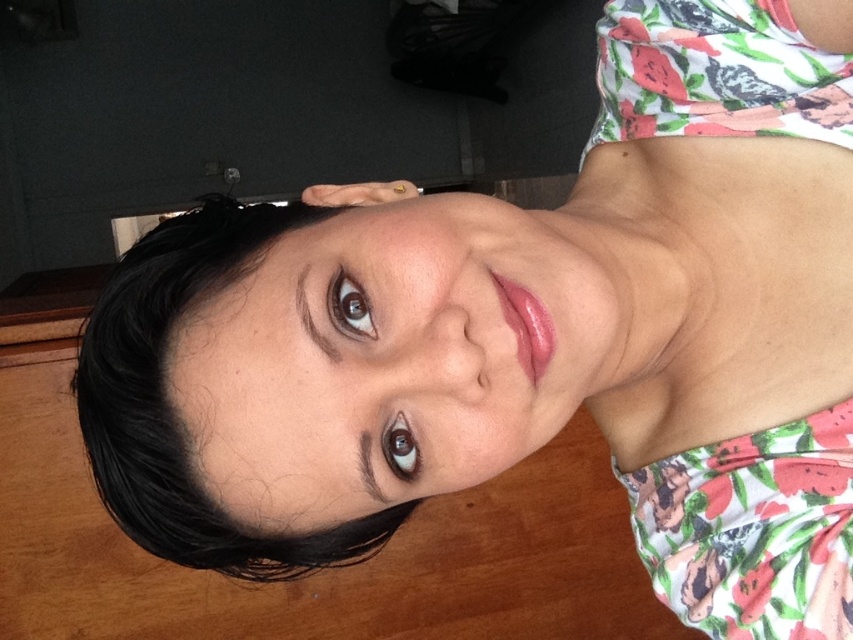
You are a photographer setting up a shoot in this room. You notice the black smooth hair at upper left and the floral fabric bikini top at upper right. Which object would you focus on first if you want to capture the larger subject in your frame?

The black smooth hair at upper left is larger in size than the floral fabric bikini top at upper right, so you should focus on the black smooth hair at upper left first to capture the larger subject.

You are standing in front of a wooden surface and want to place a small object exactly at the point labeled as point [709,625]. If your hand is 20 inches away from the surface, can you reach that point?

The distance of point [709,625] from viewer is 22.09 inches, so your hand is only 20 inches away from the surface, meaning you cannot reach the point as it is further away than your current reach.

You are a photographer standing in the room and want to take a closeup shot of the black smooth hair at upper left. Considering your current position, can you estimate whether you need to move closer or farther away to get a better closeup?

The black smooth hair at upper left is 17.52 inches away from viewer. To take a closeup shot, you would need to move closer than 17.52 inches to capture more detail, but since you are already at that distance, you might need to use a macro lens or adjust your camera settings instead of moving closer.